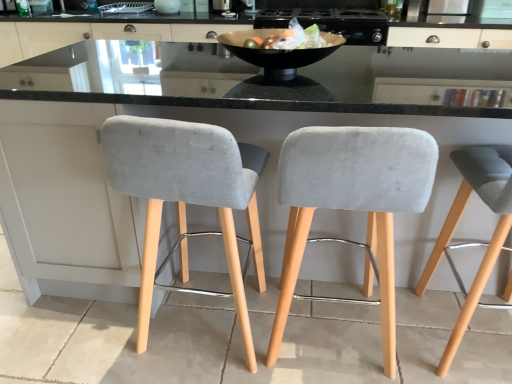
Question: Is velvet grey bar stool at left, which appears as the 1th chair when viewed from the left, facing towards matte white cabinet at upper center?

Choices:
 (A) yes
 (B) no

Answer: (B)

Question: Is velvet grey bar stool at left, the third chair when ordered from right to left, at the left side of matte white cabinet at upper center?

Choices:
 (A) no
 (B) yes

Answer: (A)

Question: From the image's perspective, is velvet grey bar stool at left, which appears as the 1th chair when viewed from the left, beneath matte white cabinet at upper center?

Choices:
 (A) yes
 (B) no

Answer: (A)

Question: From the image's perspective, is velvet grey bar stool at left, the third chair when ordered from right to left, above matte white cabinet at upper center?

Choices:
 (A) yes
 (B) no

Answer: (B)

Question: Is matte white cabinet at upper center a part of velvet grey bar stool at left, the third chair when ordered from right to left?

Choices:
 (A) no
 (B) yes

Answer: (A)

Question: From a real-world perspective, is white glossy bowl at upper center, which is the first appliance in left-to-right order, above or below metallic black pan at upper center, placed as the first appliance when sorted from right to left?

Choices:
 (A) above
 (B) below

Answer: (A)

Question: Does point pyautogui.click(x=166, y=1) appear closer or farther from the camera than point pyautogui.click(x=373, y=21)?

Choices:
 (A) farther
 (B) closer

Answer: (B)

Question: Considering the positions of white glossy bowl at upper center, which is the 2th appliance in right-to-left order, and metallic black pan at upper center, which is counted as the 2th appliance, starting from the left, in the image, is white glossy bowl at upper center, which is the 2th appliance in right-to-left order, wider or thinner than metallic black pan at upper center, which is counted as the 2th appliance, starting from the left,?

Choices:
 (A) thin
 (B) wide

Answer: (A)

Question: Considering the relative positions of white glossy bowl at upper center, which is the first appliance in left-to-right order, and metallic black pan at upper center, placed as the first appliance when sorted from right to left, in the image provided, is white glossy bowl at upper center, which is the first appliance in left-to-right order, to the left or to the right of metallic black pan at upper center, placed as the first appliance when sorted from right to left,?

Choices:
 (A) right
 (B) left

Answer: (B)

Question: Looking at their shapes, would you say velvet grey chair at center, placed as the second chair when sorted from left to right, is wider or thinner than black glossy bowl at center?

Choices:
 (A) wide
 (B) thin

Answer: (A)

Question: From the image's perspective, relative to black glossy bowl at center, is velvet grey chair at center, the 2th chair when ordered from right to left, above or below?

Choices:
 (A) above
 (B) below

Answer: (B)

Question: From a real-world perspective, is velvet grey chair at center, placed as the second chair when sorted from left to right, above or below black glossy bowl at center?

Choices:
 (A) above
 (B) below

Answer: (B)

Question: Looking at the image, does velvet grey chair at center, the 2th chair when ordered from right to left, seem bigger or smaller compared to black glossy bowl at center?

Choices:
 (A) big
 (B) small

Answer: (A)

Question: From the image's perspective, relative to velvet grey bar stool at left, which appears as the 1th chair when viewed from the left, is black glossy bowl at center above or below?

Choices:
 (A) above
 (B) below

Answer: (A)

Question: From a real-world perspective, relative to velvet grey bar stool at left, which appears as the 1th chair when viewed from the left, is black glossy bowl at center vertically above or below?

Choices:
 (A) below
 (B) above

Answer: (B)